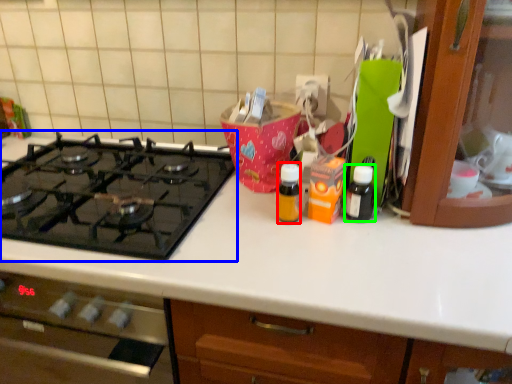
Question: Which object is positioned farthest from bottle (highlighted by a red box)? Select from gas stove (highlighted by a blue box) and bottle (highlighted by a green box).

Choices:
 (A) gas stove
 (B) bottle

Answer: (A)